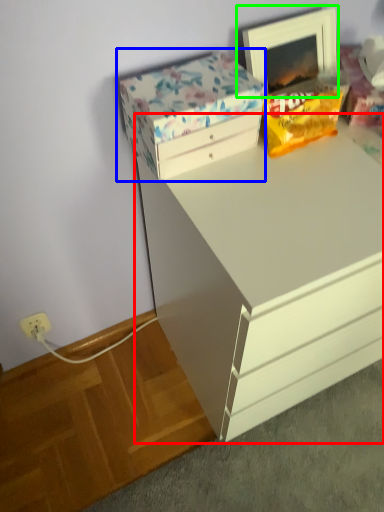
Question: Estimate the real-world distances between objects in this image. Which object is closer to chest of drawers (highlighted by a red box), storage box (highlighted by a blue box) or picture frame (highlighted by a green box)?

Choices:
 (A) storage box
 (B) picture frame

Answer: (A)